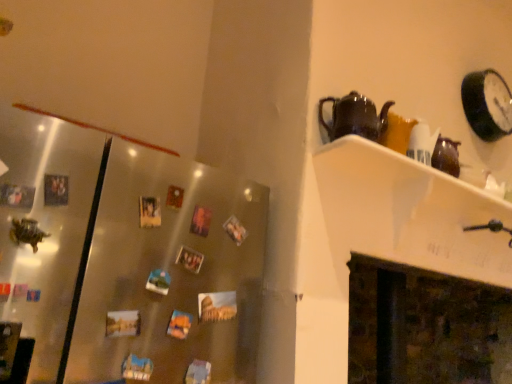
Identify the location of black glossy teapot at upper right. This screenshot has width=512, height=384. (355, 117).

What is the approximate width of white glossy shelf at upper right?

white glossy shelf at upper right is 10.35 inches in width.

In order to face dark brown stone fireplace at lower right, should I rotate leftwards or rightwards?

You should rotate right by 20.799 degrees.

Locate an element on the screen. black glossy clock at upper right is located at coordinates (487, 104).

Identify the location of black glossy teapot at upper right. (355, 117).

You are a GUI agent. You are given a task and a screenshot of the screen. Output one action in this format:
    pyautogui.click(x=<x>, y=<y>)
    Task: Click on the kettle behind the white glossy shelf at upper right
    The width and height of the screenshot is (512, 384).
    Given the screenshot: What is the action you would take?
    pyautogui.click(x=355, y=117)

What's the angular difference between black glossy teapot at upper right and white glossy shelf at upper right's facing directions?

The angle between the facing direction of black glossy teapot at upper right and the facing direction of white glossy shelf at upper right is 0.000435 degrees.

Is black glossy teapot at upper right further to camera compared to white glossy shelf at upper right?

Yes, black glossy teapot at upper right is behind white glossy shelf at upper right.

Between black glossy teapot at upper right and white glossy shelf at upper right, which one has more height?

With more height is white glossy shelf at upper right.

Based on the photo, from a real-world perspective, which is physically above, satin metallic fridge at left or black glossy clock at upper right?

From a 3D spatial view, black glossy clock at upper right is above.

Which point is more distant from viewer, [209,218] or [499,101]?

The point [499,101] is farther.

How many degrees apart are the facing directions of satin metallic fridge at left and black glossy clock at upper right?

They differ by 1.03 degrees in their facing directions.

Is satin metallic fridge at left taller or shorter than black glossy clock at upper right?

Considering their sizes, satin metallic fridge at left has more height than black glossy clock at upper right.

At what (x,y) coordinates should I click in order to perform the action: click on clock located on the right of white glossy shelf at upper right. Please return your answer as a coordinate pair (x, y). This screenshot has height=384, width=512. Looking at the image, I should click on (487, 104).

Would you say black glossy clock at upper right is inside or outside white glossy shelf at upper right?

black glossy clock at upper right exists outside the volume of white glossy shelf at upper right.

Is black glossy clock at upper right thinner than white glossy shelf at upper right?

Correct, the width of black glossy clock at upper right is less than that of white glossy shelf at upper right.

Can you tell me how much black glossy clock at upper right and white glossy shelf at upper right differ in facing direction?

They differ by 0.898 degrees in their facing directions.

Is white glossy shelf at upper right shorter than satin metallic fridge at left?

Correct, white glossy shelf at upper right is not as tall as satin metallic fridge at left.

Could you tell me if white glossy shelf at upper right is facing satin metallic fridge at left?

No, white glossy shelf at upper right is not aimed at satin metallic fridge at left.

Are white glossy shelf at upper right and satin metallic fridge at left located far from each other?

white glossy shelf at upper right is actually quite close to satin metallic fridge at left.

Is white glossy shelf at upper right situated inside satin metallic fridge at left or outside?

white glossy shelf at upper right is located beyond the bounds of satin metallic fridge at left.

Visually, is black glossy teapot at upper right positioned to the left or to the right of satin metallic fridge at left?

black glossy teapot at upper right is positioned on satin metallic fridge at left's right side.

Would you say black glossy teapot at upper right is a long distance from satin metallic fridge at left?

No.

Is black glossy teapot at upper right turned away from satin metallic fridge at left?

No, satin metallic fridge at left is not at the back of black glossy teapot at upper right.

In terms of height, does black glossy teapot at upper right look taller or shorter compared to dark brown stone fireplace at lower right?

Considering their sizes, black glossy teapot at upper right has less height than dark brown stone fireplace at lower right.

Which is correct: black glossy teapot at upper right is inside dark brown stone fireplace at lower right, or outside of it?

black glossy teapot at upper right is not inside dark brown stone fireplace at lower right, it's outside.

Looking at their sizes, would you say black glossy teapot at upper right is wider or thinner than dark brown stone fireplace at lower right?

black glossy teapot at upper right is thinner than dark brown stone fireplace at lower right.

Can you confirm if black glossy clock at upper right is thinner than satin metallic fridge at left?

Yes, black glossy clock at upper right is thinner than satin metallic fridge at left.

Are black glossy clock at upper right and satin metallic fridge at left located far from each other?

Yes.

Is black glossy clock at upper right looking in the opposite direction of satin metallic fridge at left?

No, black glossy clock at upper right is not facing the opposite direction of satin metallic fridge at left.

Between point (508, 101) and point (246, 242), which one is positioned behind?

The point (508, 101) is more distant.

At what (x,y) coordinates should I click in order to perform the action: click on shelf that appears on the right of black glossy teapot at upper right. Please return your answer as a coordinate pair (x, y). Looking at the image, I should click on (407, 214).

Locate an element on the screen. Image resolution: width=512 pixels, height=384 pixels. clock behind the satin metallic fridge at left is located at coordinates (487, 104).

Based on their spatial positions, is black glossy clock at upper right or black glossy teapot at upper right closer to dark brown stone fireplace at lower right?

Among the two, black glossy clock at upper right is located nearer to dark brown stone fireplace at lower right.

When comparing their distances from satin metallic fridge at left, does black glossy clock at upper right or dark brown stone fireplace at lower right seem further?

dark brown stone fireplace at lower right.

From the image, which object appears to be farther from satin metallic fridge at left, dark brown stone fireplace at lower right or black glossy teapot at upper right?

dark brown stone fireplace at lower right is further to satin metallic fridge at left.

From the image, which object appears to be nearer to black glossy clock at upper right, white glossy shelf at upper right or dark brown stone fireplace at lower right?

Among the two, white glossy shelf at upper right is located nearer to black glossy clock at upper right.

From the image, which object appears to be nearer to black glossy teapot at upper right, black glossy clock at upper right or dark brown stone fireplace at lower right?

black glossy clock at upper right lies closer to black glossy teapot at upper right than the other object.

Which object lies further to the anchor point black glossy teapot at upper right, dark brown stone fireplace at lower right or satin metallic fridge at left?

dark brown stone fireplace at lower right is positioned further to the anchor black glossy teapot at upper right.

Considering their positions, is white glossy shelf at upper right positioned further to black glossy teapot at upper right than black glossy clock at upper right?

Based on the image, black glossy clock at upper right appears to be further to black glossy teapot at upper right.

From the image, which object appears to be farther from black glossy teapot at upper right, satin metallic fridge at left or black glossy clock at upper right?

Based on the image, black glossy clock at upper right appears to be further to black glossy teapot at upper right.

Where is `kettle positioned between white glossy shelf at upper right and black glossy clock at upper right from near to far`? The width and height of the screenshot is (512, 384). kettle positioned between white glossy shelf at upper right and black glossy clock at upper right from near to far is located at coordinates (355, 117).

At what (x,y) coordinates should I click in order to perform the action: click on fireplace situated between satin metallic fridge at left and black glossy clock at upper right from left to right. Please return your answer as a coordinate pair (x, y). Image resolution: width=512 pixels, height=384 pixels. Looking at the image, I should click on (425, 327).

Identify the location of shelf between satin metallic fridge at left and black glossy clock at upper right from left to right. (407, 214).

Where is `shelf between black glossy clock at upper right and dark brown stone fireplace at lower right in the vertical direction`? The image size is (512, 384). shelf between black glossy clock at upper right and dark brown stone fireplace at lower right in the vertical direction is located at coordinates (407, 214).